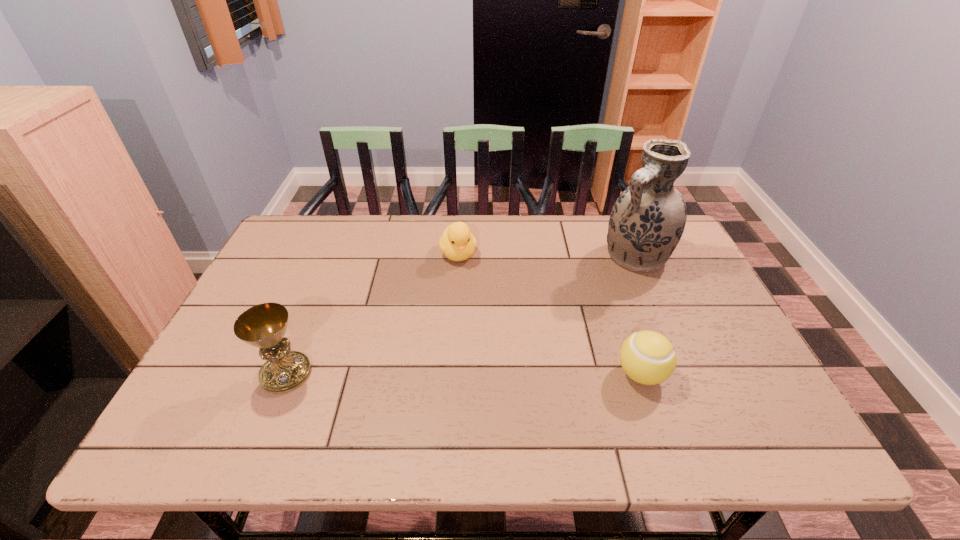
You are a GUI agent. You are given a task and a screenshot of the screen. Output one action in this format:
    pyautogui.click(x=<x>, y=<y>)
    Task: Click on the chalice
    This screenshot has width=960, height=540.
    Given the screenshot: What is the action you would take?
    264,325

I want to click on the leftmost object, so click(264, 325).

The width and height of the screenshot is (960, 540). In order to click on tennis ball in this screenshot , I will do tap(647, 357).

Locate an element on the screen. duck is located at coordinates (457, 243).

Where is `vase`? The width and height of the screenshot is (960, 540). vase is located at coordinates (647, 221).

You are a GUI agent. You are given a task and a screenshot of the screen. Output one action in this format:
    pyautogui.click(x=<x>, y=<y>)
    Task: Click on the blank area located 0.220m on the right of the chalice
    The image size is (960, 540).
    Given the screenshot: What is the action you would take?
    pyautogui.click(x=407, y=373)

Image resolution: width=960 pixels, height=540 pixels. In order to click on vacant space located 0.370m on the back of the tennis ball in this screenshot , I will do `click(602, 257)`.

I want to click on vacant space situated 0.330m on the front-facing side of the duck, so click(498, 353).

Find the location of a particular element. The image size is (960, 540). blank space located 0.290m on the front-facing side of the duck is located at coordinates (493, 341).

The image size is (960, 540). Identify the location of free region located 0.110m on the front-facing side of the duck. (473, 293).